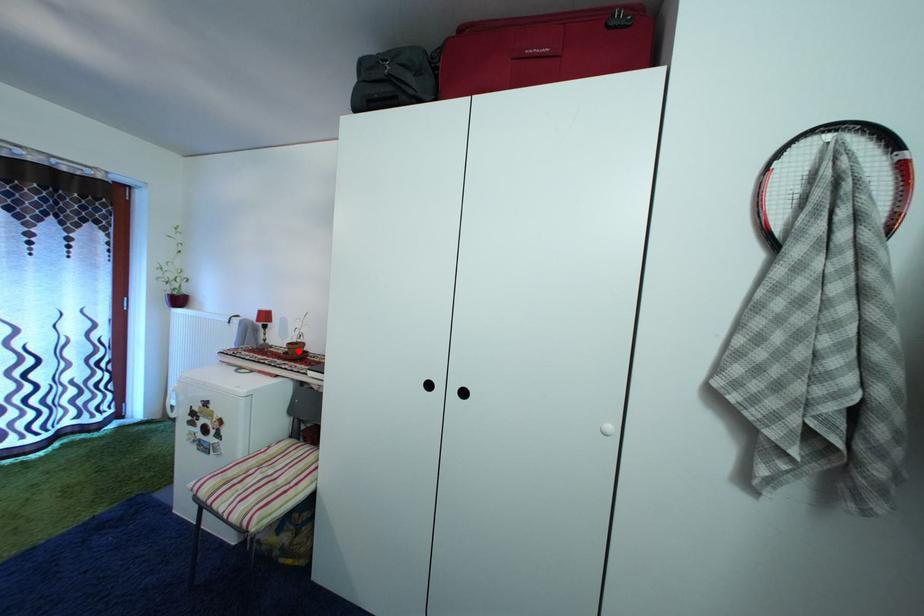
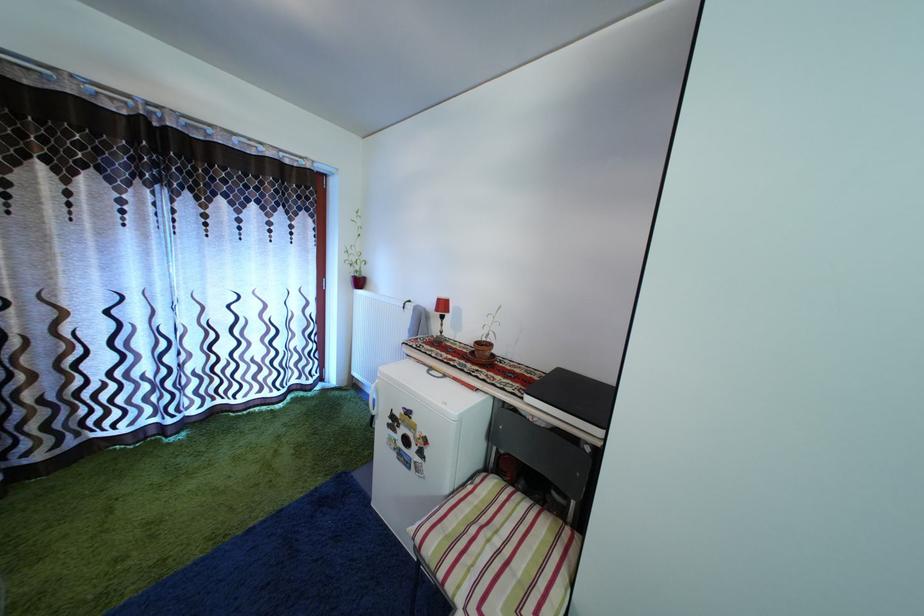
The point at the highlighted location is marked in the first image. Where is the corresponding point in the second image?

(485, 350)